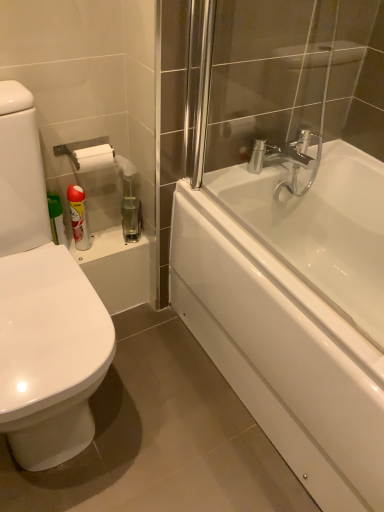
Question: Is clear glass shower door at upper right behind white glossy bathtub at right?

Choices:
 (A) yes
 (B) no

Answer: (A)

Question: From the image's perspective, is clear glass shower door at upper right above white glossy bathtub at right?

Choices:
 (A) no
 (B) yes

Answer: (B)

Question: From a real-world perspective, is clear glass shower door at upper right on top of white glossy bathtub at right?

Choices:
 (A) yes
 (B) no

Answer: (A)

Question: Would you say clear glass shower door at upper right is a long distance from white glossy bathtub at right?

Choices:
 (A) yes
 (B) no

Answer: (B)

Question: Is clear glass shower door at upper right smaller than white glossy bathtub at right?

Choices:
 (A) no
 (B) yes

Answer: (B)

Question: Can you confirm if clear glass shower door at upper right is taller than white glossy bathtub at right?

Choices:
 (A) yes
 (B) no

Answer: (A)

Question: Are white glossy bathtub at right and white glossy bathtub at right far apart?

Choices:
 (A) yes
 (B) no

Answer: (B)

Question: Is the depth of white glossy bathtub at right less than that of white glossy bathtub at right?

Choices:
 (A) yes
 (B) no

Answer: (A)

Question: Considering the relative sizes of white glossy bathtub at right and white glossy bathtub at right in the image provided, is white glossy bathtub at right bigger than white glossy bathtub at right?

Choices:
 (A) yes
 (B) no

Answer: (B)

Question: From a real-world perspective, is white glossy bathtub at right beneath white glossy bathtub at right?

Choices:
 (A) no
 (B) yes

Answer: (A)

Question: From the image's perspective, would you say white glossy bathtub at right is shown under white glossy bathtub at right?

Choices:
 (A) yes
 (B) no

Answer: (B)

Question: Is white glossy bathtub at right positioned beyond the bounds of white glossy bathtub at right?

Choices:
 (A) yes
 (B) no

Answer: (A)

Question: Is translucent plastic spray bottle at upper left positioned beyond the bounds of white glossy bathtub at right?

Choices:
 (A) yes
 (B) no

Answer: (A)